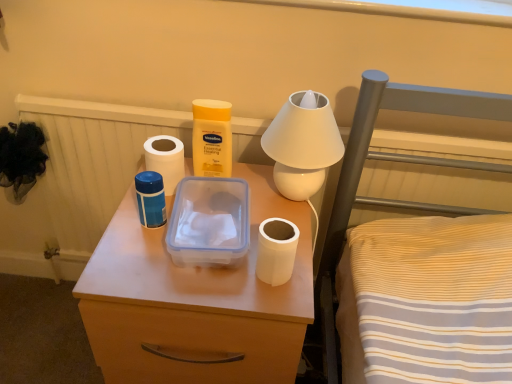
Image resolution: width=512 pixels, height=384 pixels. In order to click on blank space to the left of white matte toilet paper at center, which is the second toilet paper from top to bottom in this screenshot , I will do `click(190, 274)`.